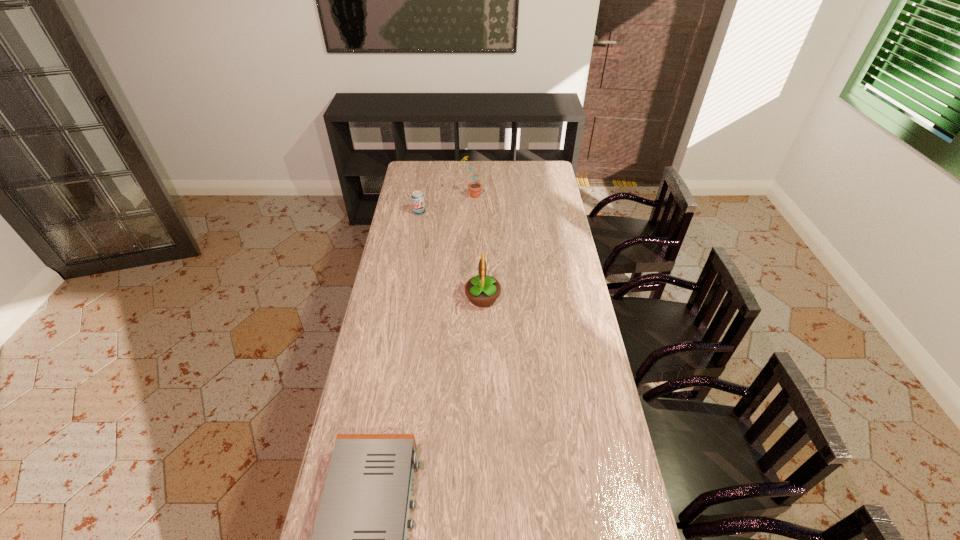
The width and height of the screenshot is (960, 540). In order to click on the closest object to the third nearest object in this screenshot , I will do `click(475, 188)`.